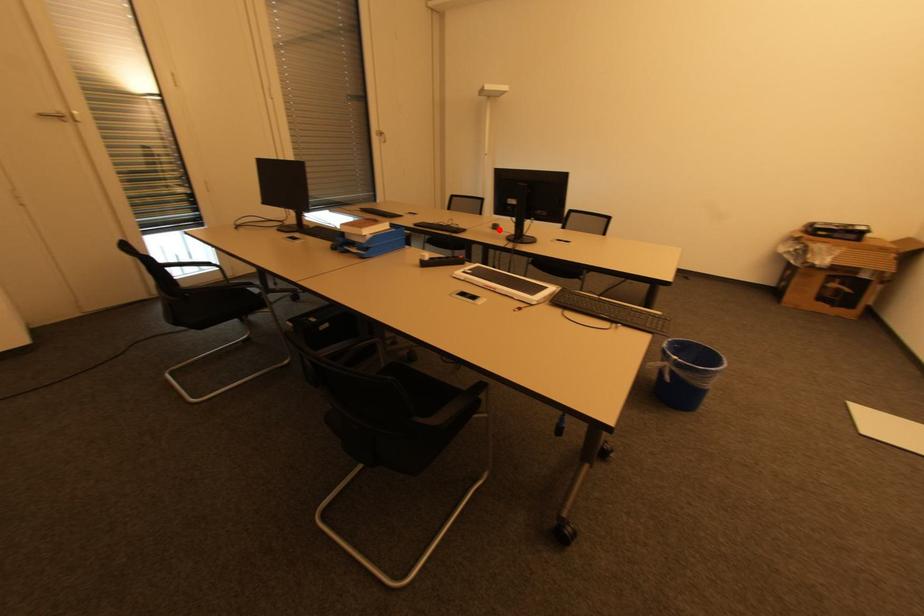
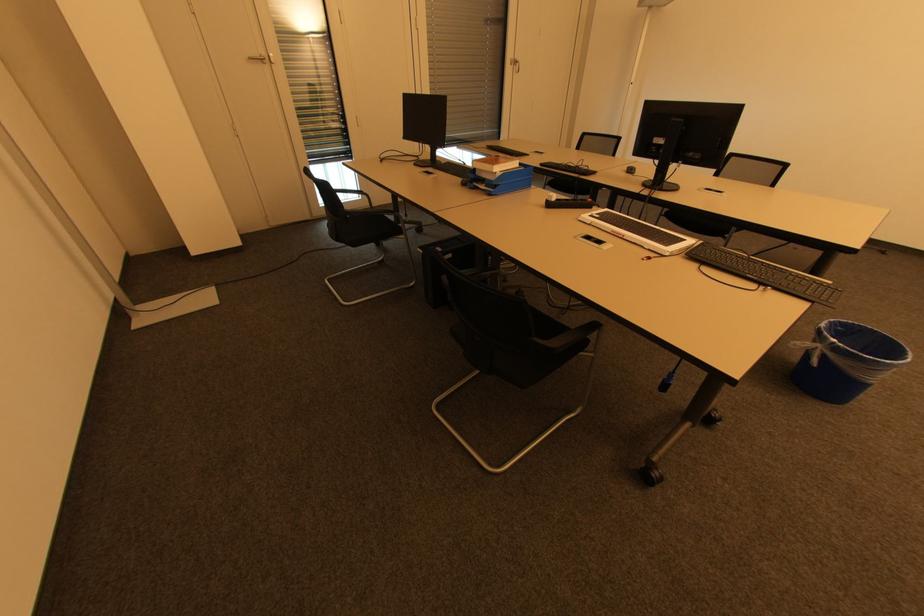
Question: I am providing you with two images of the same scene from different viewpoints. A red point is marked on the first image. Can you still see the location of the red point in image 2?

Choices:
 (A) Yes
 (B) No

Answer: (A)